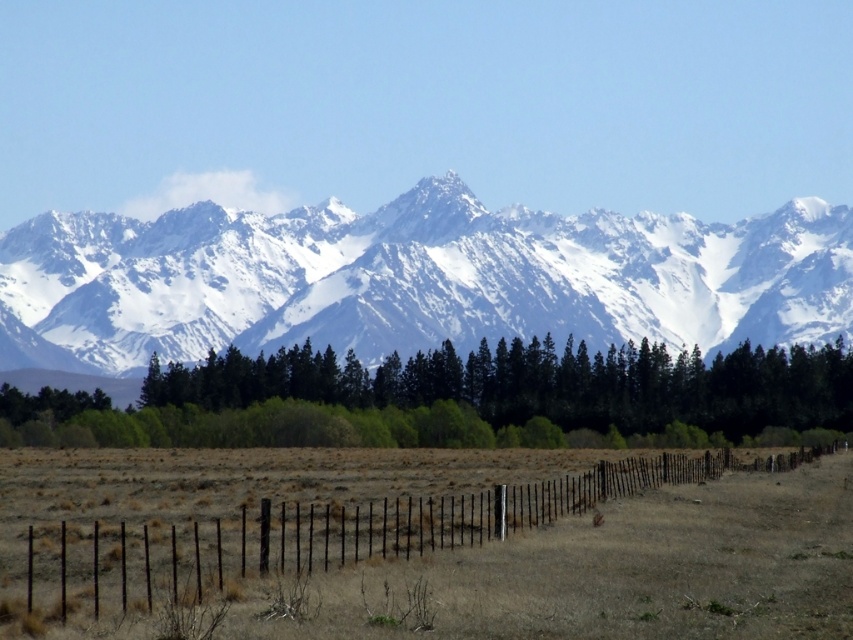
You are standing in the open field and see two points in the scene. One is labeled as point (30,288) and the other as point (671,372). Which point is closer to you?

Point (30,288) is further to the camera than point (671,372), so the point closer to you is point (671,372).

In the scene shown: You are a photographer planning to capture the snowy granite mountain range at upper center and the black wire fence at lower center in a single frame. Given that the fence is closer to you, will the mountain range appear larger or smaller in the photo compared to the fence?

The snowy granite mountain range at upper center is much taller than the black wire fence at lower center, so even though the fence is closer, the mountain range will still appear larger in the photo.